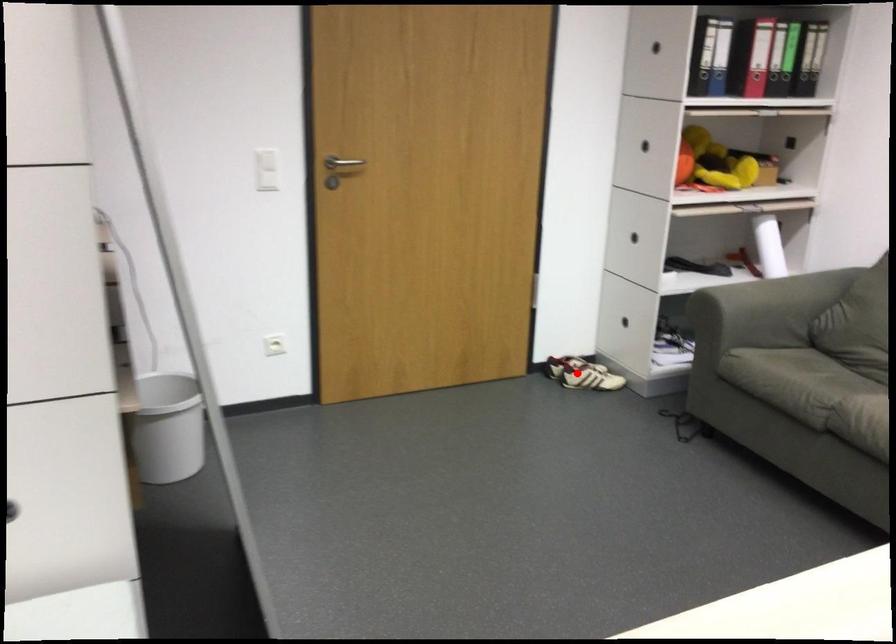
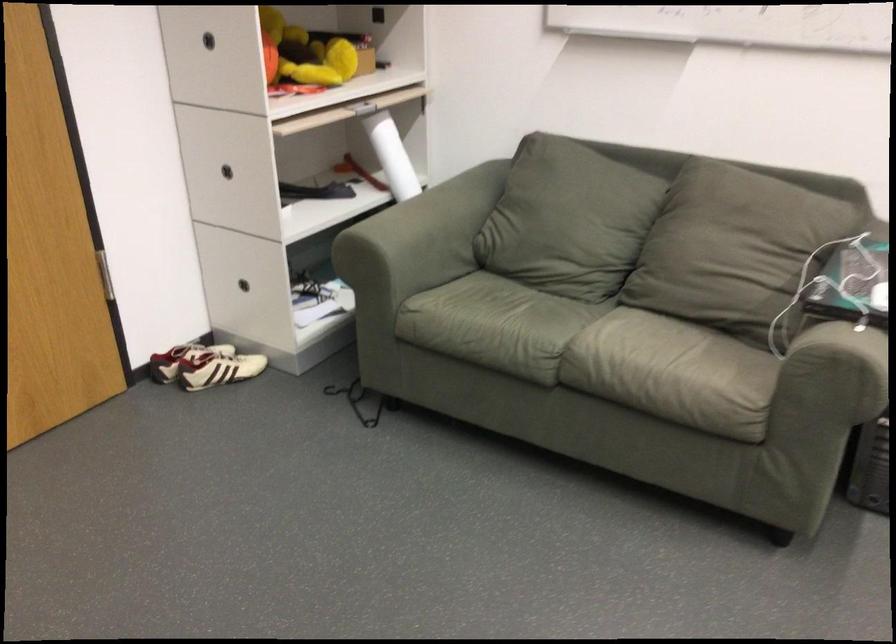
Question: A red point is marked in image1. In image2, is the corresponding 3D point closer to the camera or farther? Reply with the corresponding letter.

Choices:
 (A) The corresponding 3D point is closer.
 (B) The corresponding 3D point is farther.

Answer: (A)